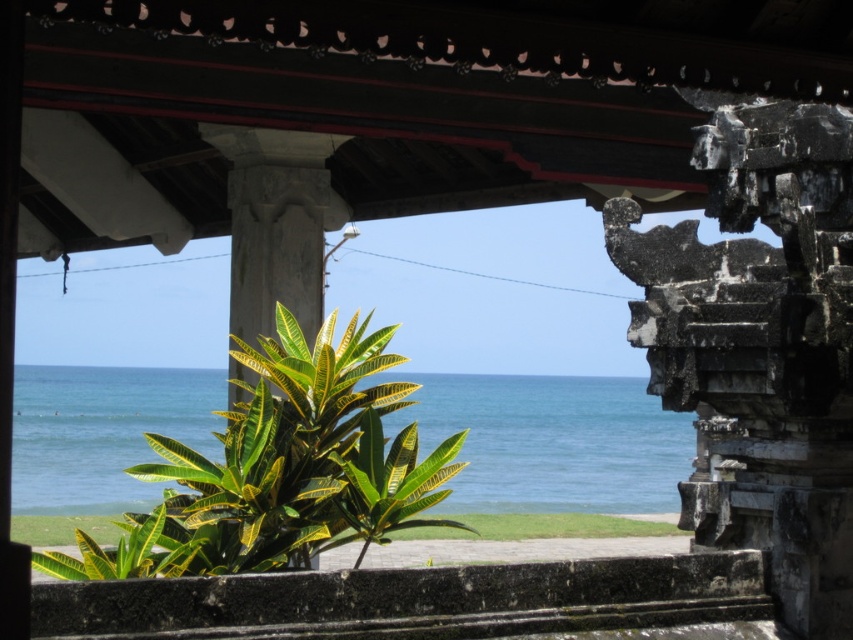
You are standing in a coastal temple and want to take a photo of the blue water at center and the green leafy plant at center. Which object will occupy more space in your photo?

The blue water at center will occupy more space in the photo because its width is larger than the green leafy plant at center.

You are standing at the traditional structure with intricate stone carvings and a red roof. You see a point marked at coordinates (552, 442). Based on the scene, can you determine what the point is located on?

The point (552, 442) is on blue water at center.